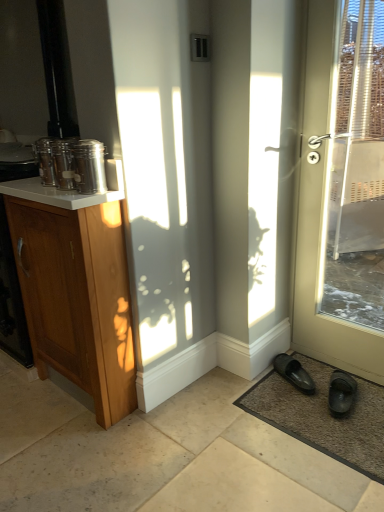
Question: Is brown textured mat at lower right to the left or to the right of matte white door at right in the image?

Choices:
 (A) left
 (B) right

Answer: (A)

Question: Is point (372, 389) positioned closer to the camera than point (311, 259)?

Choices:
 (A) closer
 (B) farther

Answer: (A)

Question: Which object is positioned closest to the wooden cabinet at left?

Choices:
 (A) brushed metal canister at upper left
 (B) matte white door at right
 (C) brown textured mat at lower right
 (D) white glossy counter top at upper left
 (E) black rubber slippers at lower right, which appears as the 1th footwear when viewed from the right

Answer: (D)

Question: Which of these objects is positioned farthest from the matte white door at right?

Choices:
 (A) brushed metal canister at upper left
 (B) black rubber slipper at lower right, the 1th footwear when ordered from left to right
 (C) wooden cabinet at left
 (D) black rubber slippers at lower right, marked as the second footwear in a left-to-right arrangement
 (E) white glossy counter top at upper left

Answer: (C)